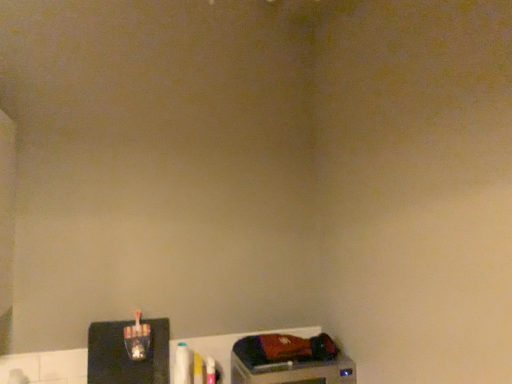
The height and width of the screenshot is (384, 512). Describe the element at coordinates (290, 361) in the screenshot. I see `metallic silver water cooler at bottom right` at that location.

This screenshot has width=512, height=384. In order to click on metallic silver water cooler at bottom right in this screenshot , I will do `click(290, 361)`.

Measure the distance between point (282, 334) and camera.

Point (282, 334) and camera are 1.81 meters apart from each other.

Where is `metallic silver water cooler at bottom right`? metallic silver water cooler at bottom right is located at coordinates (290, 361).